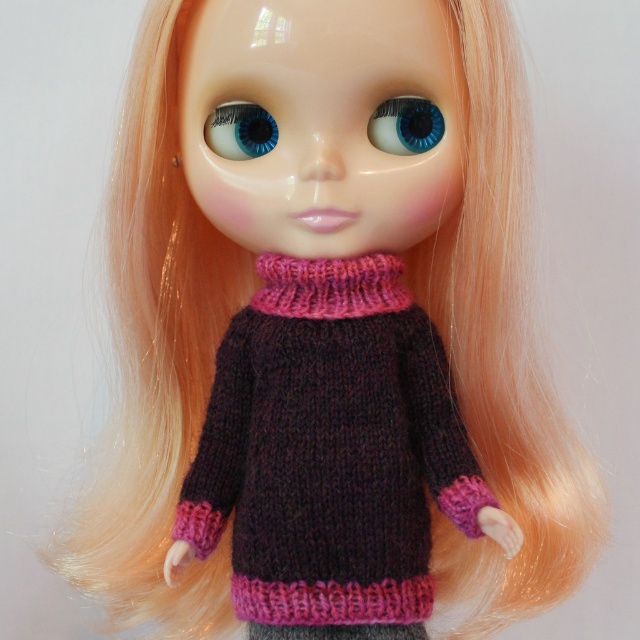
Find the location of a particular element. The image size is (640, 640). knitted dark purple sweater at center is located at coordinates pos(330,449).

Based on the photo, does knitted dark purple sweater at center have a greater width compared to blue glossy eye at center?

Correct, the width of knitted dark purple sweater at center exceeds that of blue glossy eye at center.

The height and width of the screenshot is (640, 640). What are the coordinates of `knitted dark purple sweater at center` in the screenshot? It's located at (330, 449).

In order to click on knitted dark purple sweater at center in this screenshot , I will do `click(330, 449)`.

Who is positioned more to the left, blue glossy eye at center or blue glossy eye at upper center?

blue glossy eye at upper center

Does blue glossy eye at center appear under blue glossy eye at upper center?

No.

Which is behind, point (424, 108) or point (224, 120)?

The point (224, 120) is behind.

Where is `blue glossy eye at center`? blue glossy eye at center is located at coordinates pyautogui.click(x=404, y=125).

Is knitted dark purple sweater at center positioned before blue glossy eye at upper center?

That is True.

Is knitted dark purple sweater at center shorter than blue glossy eye at upper center?

No, knitted dark purple sweater at center is not shorter than blue glossy eye at upper center.

Describe the element at coordinates (330, 449) in the screenshot. I see `knitted dark purple sweater at center` at that location.

Find the location of a particular element. knitted dark purple sweater at center is located at coordinates (330, 449).